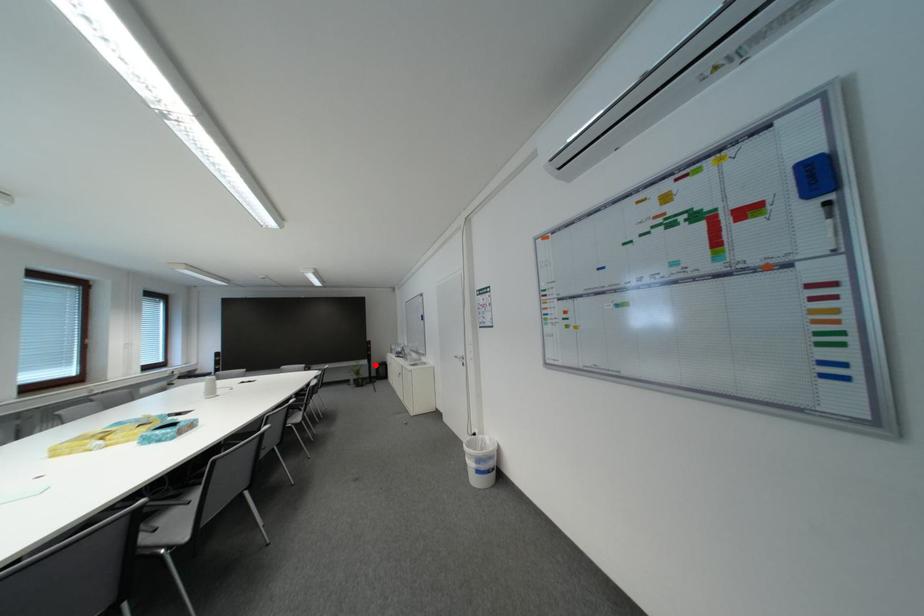
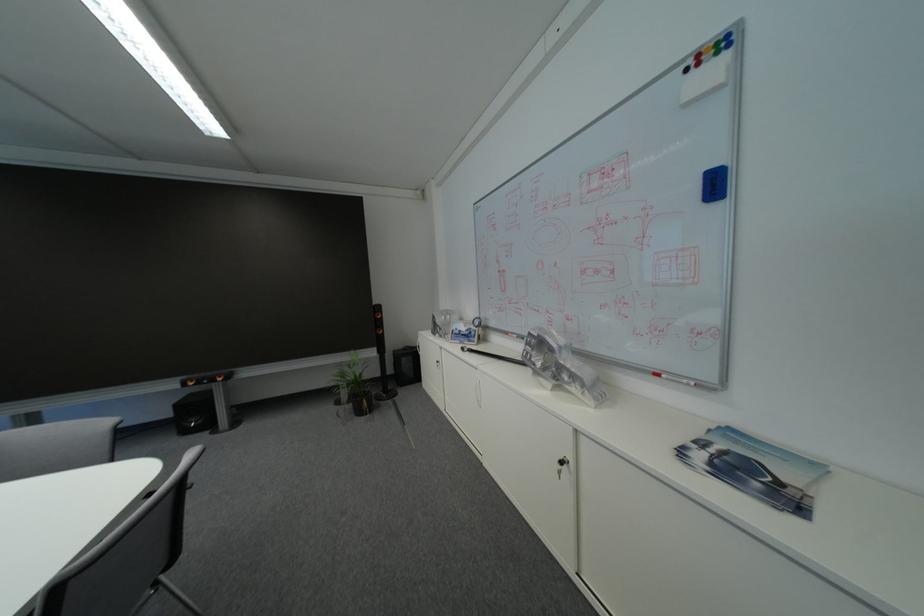
In the second image, find the point that corresponds to the highlighted location in the first image.

(382, 355)